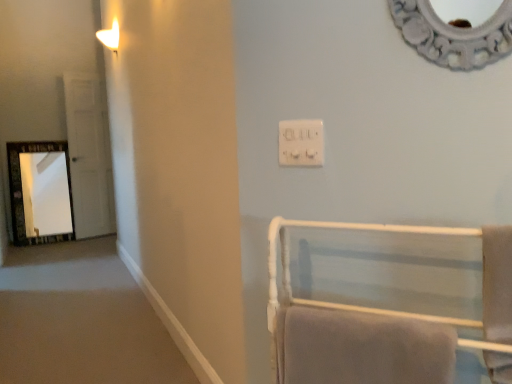
Find the location of a particular element. The height and width of the screenshot is (384, 512). white soft towel at right, arranged as the second bath towel when viewed from the left is located at coordinates (497, 283).

This screenshot has height=384, width=512. What do you see at coordinates (301, 143) in the screenshot? I see `white plastic electrical outlet at upper center` at bounding box center [301, 143].

Locate an element on the screen. The image size is (512, 384). matte white sconce at upper left is located at coordinates (110, 37).

Where is `white towel rack at lower right`? The width and height of the screenshot is (512, 384). white towel rack at lower right is located at coordinates (387, 301).

Locate an element on the screen. This screenshot has width=512, height=384. white soft towel at right, arranged as the second bath towel when viewed from the left is located at coordinates (497, 283).

Considering the sizes of objects white glossy door at left and white towel rack at lower right in the image provided, who is taller, white glossy door at left or white towel rack at lower right?

With more height is white glossy door at left.

Consider the image. From a real-world perspective, is white glossy door at left over white towel rack at lower right?

Yes.

Which is in front, point (91, 220) or point (393, 329)?

The point (393, 329) is closer to the camera.

From a real-world perspective, is white soft towel at lower right, positioned as the first bath towel in left-to-right order, positioned above or below white soft towel at right, arranged as the second bath towel when viewed from the left?

white soft towel at lower right, positioned as the first bath towel in left-to-right order, is below white soft towel at right, arranged as the second bath towel when viewed from the left.

Considering the positions of objects white soft towel at lower right, which is the second bath towel in right-to-left order, and white soft towel at right, which is the first bath towel from right to left, in the image provided, who is more to the left, white soft towel at lower right, which is the second bath towel in right-to-left order, or white soft towel at right, which is the first bath towel from right to left,?

white soft towel at lower right, which is the second bath towel in right-to-left order.

Who is shorter, white soft towel at lower right, which is the second bath towel in right-to-left order, or white soft towel at right, arranged as the second bath towel when viewed from the left?

white soft towel at lower right, which is the second bath towel in right-to-left order.

Considering the relative sizes of white soft towel at lower right, positioned as the first bath towel in left-to-right order, and white soft towel at right, which is the first bath towel from right to left, in the image provided, is white soft towel at lower right, positioned as the first bath towel in left-to-right order, wider than white soft towel at right, which is the first bath towel from right to left,?

Yes, white soft towel at lower right, positioned as the first bath towel in left-to-right order, is wider than white soft towel at right, which is the first bath towel from right to left.

From a real-world perspective, is white plastic electrical outlet at upper center over matte white sconce at upper left?

No, from a real-world perspective, white plastic electrical outlet at upper center is not above matte white sconce at upper left.

Is white plastic electrical outlet at upper center aimed at matte white sconce at upper left?

No, white plastic electrical outlet at upper center is not facing towards matte white sconce at upper left.

Can you confirm if white plastic electrical outlet at upper center is shorter than matte white sconce at upper left?

Yes.

Is point (307, 156) farther from camera compared to point (106, 39)?

No.

From the image's perspective, between matte white sconce at upper left and white soft towel at right, arranged as the second bath towel when viewed from the left, which one is located above?

matte white sconce at upper left.

Which object is further away from the camera taking this photo, matte white sconce at upper left or white soft towel at right, which is the first bath towel from right to left?

matte white sconce at upper left is further from the camera.

Measure the distance between matte white sconce at upper left and white soft towel at right, arranged as the second bath towel when viewed from the left.

matte white sconce at upper left and white soft towel at right, arranged as the second bath towel when viewed from the left, are 10.81 feet apart.

From the image's perspective, is white soft towel at right, which is the first bath towel from right to left, above white soft towel at lower right, which is the second bath towel in right-to-left order?

Yes, from the image's perspective, white soft towel at right, which is the first bath towel from right to left, is on top of white soft towel at lower right, which is the second bath towel in right-to-left order.

Which of these two, white soft towel at right, which is the first bath towel from right to left, or white soft towel at lower right, positioned as the first bath towel in left-to-right order, is bigger?

white soft towel at lower right, positioned as the first bath towel in left-to-right order, is bigger.

Who is shorter, white soft towel at right, arranged as the second bath towel when viewed from the left, or white soft towel at lower right, positioned as the first bath towel in left-to-right order?

With less height is white soft towel at lower right, positioned as the first bath towel in left-to-right order.

Is point (301, 231) farther from viewer compared to point (371, 347)?

Yes, point (301, 231) is farther from viewer.

Are white towel rack at lower right and white soft towel at lower right, positioned as the first bath towel in left-to-right order, making contact?

Yes, white towel rack at lower right is right next to white soft towel at lower right, positioned as the first bath towel in left-to-right order, and making contact.

Would you say white towel rack at lower right is outside white soft towel at lower right, positioned as the first bath towel in left-to-right order?

Absolutely, white towel rack at lower right is external to white soft towel at lower right, positioned as the first bath towel in left-to-right order.

Does white towel rack at lower right appear on the left side of white soft towel at lower right, which is the second bath towel in right-to-left order?

No, white towel rack at lower right is not to the left of white soft towel at lower right, which is the second bath towel in right-to-left order.

Is white plastic electrical outlet at upper center to the left or to the right of white soft towel at lower right, which is the second bath towel in right-to-left order, in the image?

white plastic electrical outlet at upper center is to the left of white soft towel at lower right, which is the second bath towel in right-to-left order.

Would you say white plastic electrical outlet at upper center is inside or outside white soft towel at lower right, which is the second bath towel in right-to-left order?

white plastic electrical outlet at upper center lies outside white soft towel at lower right, which is the second bath towel in right-to-left order.

Is white plastic electrical outlet at upper center oriented towards white soft towel at lower right, which is the second bath towel in right-to-left order?

No, white plastic electrical outlet at upper center is not facing towards white soft towel at lower right, which is the second bath towel in right-to-left order.

From the image's perspective, which is above, white plastic electrical outlet at upper center or white soft towel at lower right, which is the second bath towel in right-to-left order?

white plastic electrical outlet at upper center appears higher in the image.

The height and width of the screenshot is (384, 512). Identify the location of furniture below the white glossy door at left (from the image's perspective). (387, 301).

This screenshot has width=512, height=384. In order to click on bath towel above the white soft towel at lower right, which is the second bath towel in right-to-left order (from the image's perspective) in this screenshot , I will do `click(497, 283)`.

Based on their spatial positions, is white soft towel at lower right, which is the second bath towel in right-to-left order, or matte white sconce at upper left closer to white glossy door at left?

matte white sconce at upper left is positioned closer to the anchor white glossy door at left.

Looking at the image, which one is located closer to white soft towel at lower right, positioned as the first bath towel in left-to-right order, white glossy door at left or white plastic electrical outlet at upper center?

Based on the image, white plastic electrical outlet at upper center appears to be nearer to white soft towel at lower right, positioned as the first bath towel in left-to-right order.

Which object lies further to the anchor point white soft towel at right, which is the first bath towel from right to left, white glossy door at left or white soft towel at lower right, which is the second bath towel in right-to-left order?

white glossy door at left is positioned further to the anchor white soft towel at right, which is the first bath towel from right to left.

Looking at the image, which one is located further to white soft towel at lower right, which is the second bath towel in right-to-left order, white towel rack at lower right or white glossy door at left?

white glossy door at left is positioned further to the anchor white soft towel at lower right, which is the second bath towel in right-to-left order.

Estimate the real-world distances between objects in this image. Which object is further from white soft towel at lower right, positioned as the first bath towel in left-to-right order, white towel rack at lower right or white soft towel at right, which is the first bath towel from right to left?

white soft towel at right, which is the first bath towel from right to left, is positioned further to the anchor white soft towel at lower right, positioned as the first bath towel in left-to-right order.

When comparing their distances from white soft towel at lower right, which is the second bath towel in right-to-left order, does matte white sconce at upper left or white plastic electrical outlet at upper center seem closer?

white plastic electrical outlet at upper center is positioned closer to the anchor white soft towel at lower right, which is the second bath towel in right-to-left order.

Based on the photo, estimate the real-world distances between objects in this image. Which object is further from white soft towel at lower right, positioned as the first bath towel in left-to-right order, white plastic electrical outlet at upper center or white towel rack at lower right?

The object further to white soft towel at lower right, positioned as the first bath towel in left-to-right order, is white plastic electrical outlet at upper center.

Looking at this image, when comparing their distances from matte white sconce at upper left, does white soft towel at lower right, positioned as the first bath towel in left-to-right order, or white plastic electrical outlet at upper center seem further?

white soft towel at lower right, positioned as the first bath towel in left-to-right order.

Image resolution: width=512 pixels, height=384 pixels. In order to click on furniture situated between white soft towel at lower right, positioned as the first bath towel in left-to-right order, and white soft towel at right, which is the first bath towel from right to left, from left to right in this screenshot , I will do `click(387, 301)`.

Find the location of `electric outlet positioned between white soft towel at lower right, which is the second bath towel in right-to-left order, and white glossy door at left from near to far`. electric outlet positioned between white soft towel at lower right, which is the second bath towel in right-to-left order, and white glossy door at left from near to far is located at coordinates (301, 143).

Find the location of a particular element. electric outlet between white soft towel at right, arranged as the second bath towel when viewed from the left, and matte white sconce at upper left, along the z-axis is located at coordinates (301, 143).

Where is `electric outlet located between white towel rack at lower right and matte white sconce at upper left in the depth direction`? The height and width of the screenshot is (384, 512). electric outlet located between white towel rack at lower right and matte white sconce at upper left in the depth direction is located at coordinates (301, 143).